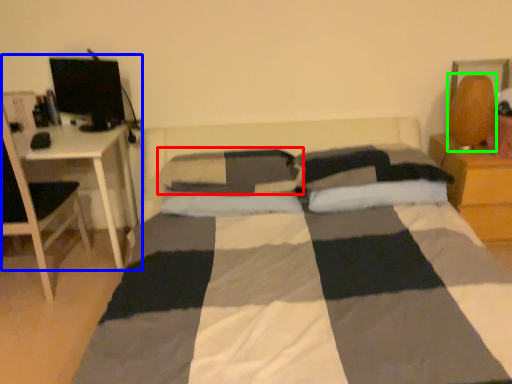
Question: Considering the real-world distances, which object is closest to pillow (highlighted by a red box)? computer desk (highlighted by a blue box) or table lamp (highlighted by a green box).

Choices:
 (A) computer desk
 (B) table lamp

Answer: (A)